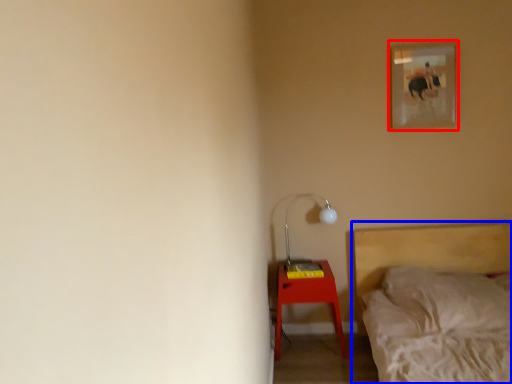
Question: Which point is further to the camera, picture frame (highlighted by a red box) or bed (highlighted by a blue box)?

Choices:
 (A) picture frame
 (B) bed

Answer: (A)